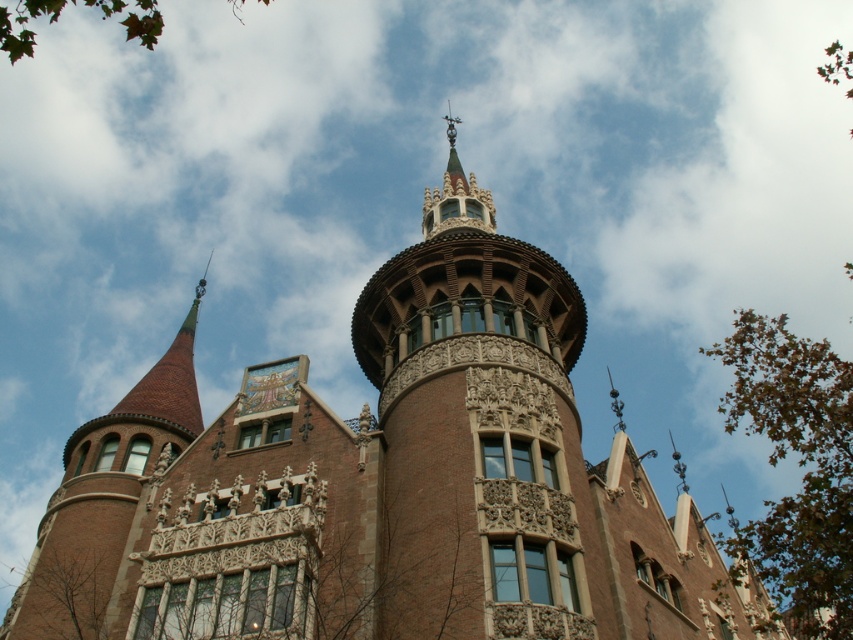
Question: Is brown textured tree at lower left behind green leafy tree at upper left?

Choices:
 (A) yes
 (B) no

Answer: (A)

Question: Can you confirm if brown textured tree at lower left is positioned above green leafy tree at upper left?

Choices:
 (A) yes
 (B) no

Answer: (B)

Question: Which of the following is the closest to the observer?

Choices:
 (A) (758, 337)
 (B) (6, 35)

Answer: (B)

Question: Considering the real-world distances, which object is farthest from the brown textured tree at lower left?

Choices:
 (A) green leafy tree at right
 (B) green leafy tree at upper left

Answer: (B)

Question: Is green leafy tree at right thinner than brown textured tree at lower left?

Choices:
 (A) yes
 (B) no

Answer: (B)

Question: Which point is farther from the camera taking this photo?

Choices:
 (A) (149, 8)
 (B) (83, 595)
 (C) (822, 499)

Answer: (A)